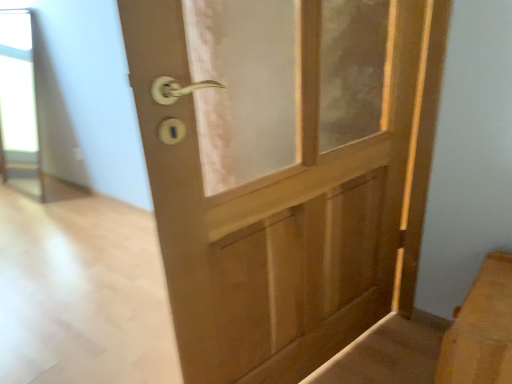
Describe the element at coordinates (285, 170) in the screenshot. I see `natural wood door at center` at that location.

Locate an element on the screen. natural wood door at center is located at coordinates (285, 170).

You are a GUI agent. You are given a task and a screenshot of the screen. Output one action in this format:
    pyautogui.click(x=<x>, y=<y>)
    Task: Click on the natural wood door at center
    This screenshot has width=512, height=384.
    Given the screenshot: What is the action you would take?
    pyautogui.click(x=285, y=170)